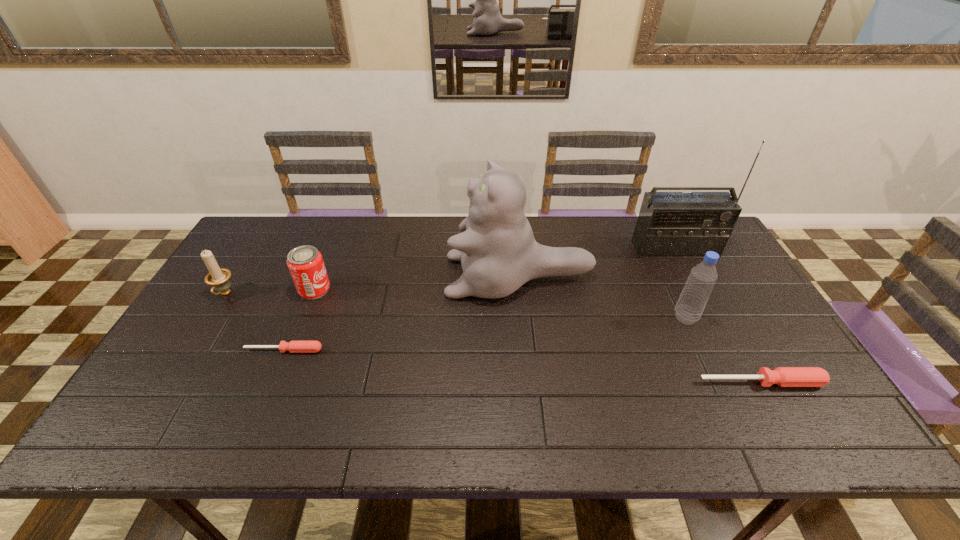
Locate an element on the screen. This screenshot has height=540, width=960. the farther screwdriver is located at coordinates (293, 346).

Locate an element on the screen. The image size is (960, 540). the shorter screwdriver is located at coordinates (293, 346).

At what (x,y) coordinates should I click in order to perform the action: click on the nearest object. Please return your answer as a coordinate pair (x, y). This screenshot has height=540, width=960. Looking at the image, I should click on (782, 376).

Identify the location of the taller screwdriver. Image resolution: width=960 pixels, height=540 pixels. (782, 376).

The height and width of the screenshot is (540, 960). What are the coordinates of `the fifth tallest object` in the screenshot? It's located at (305, 263).

Locate an element on the screen. radio receiver is located at coordinates (670, 224).

You are a GUI agent. You are given a task and a screenshot of the screen. Output one action in this format:
    pyautogui.click(x=<x>, y=<y>)
    Task: Click on the fourth object from left to right
    The image size is (960, 540).
    Given the screenshot: What is the action you would take?
    pyautogui.click(x=498, y=253)

This screenshot has height=540, width=960. I want to click on candle_holder, so click(219, 278).

I want to click on the third nearest object, so click(689, 308).

At what (x,y) coordinates should I click in order to perform the action: click on the third tallest object. Please return your answer as a coordinate pair (x, y). Looking at the image, I should click on (689, 308).